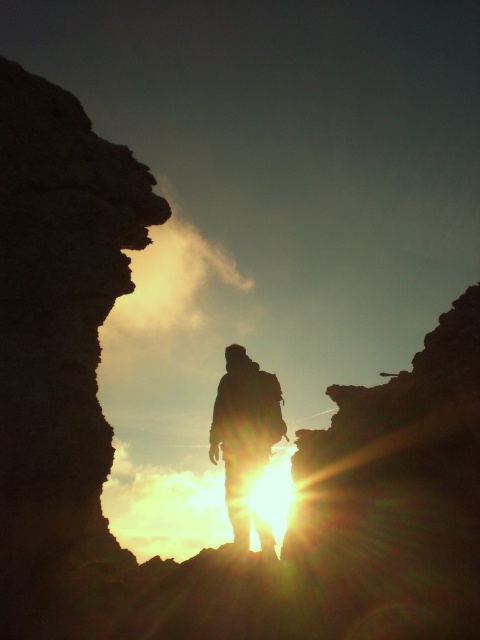
You are planning to take a photo of the rugged stone cliff at left and the silhouette backpack at center. Based on their sizes in the image, which object would likely occupy a larger portion of the photo?

The rugged stone cliff at left might be wider than the silhouette backpack at center, so it would likely occupy a larger portion of the photo.